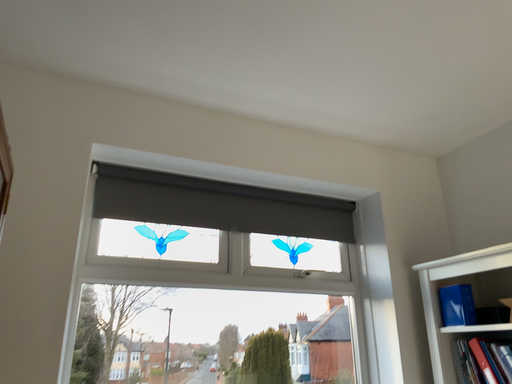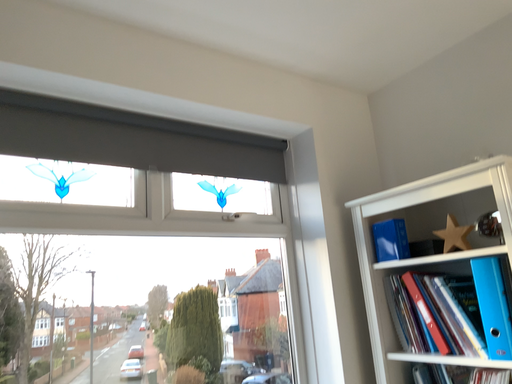
Question: Which way did the camera rotate in the video?

Choices:
 (A) rotated right
 (B) rotated left

Answer: (A)